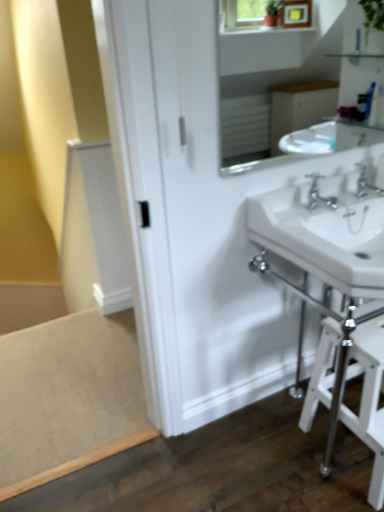
Question: Considering the relative sizes of white ceramic sink at right and white glossy sink at upper center in the image provided, is white ceramic sink at right bigger than white glossy sink at upper center?

Choices:
 (A) no
 (B) yes

Answer: (B)

Question: Does white ceramic sink at right have a smaller size compared to white glossy sink at upper center?

Choices:
 (A) yes
 (B) no

Answer: (B)

Question: From the image's perspective, would you say white ceramic sink at right is shown under white glossy sink at upper center?

Choices:
 (A) no
 (B) yes

Answer: (B)

Question: Is white ceramic sink at right completely or partially outside of white glossy sink at upper center?

Choices:
 (A) no
 (B) yes

Answer: (B)

Question: Does white ceramic sink at right have a lesser height compared to white glossy sink at upper center?

Choices:
 (A) no
 (B) yes

Answer: (B)

Question: From the image's perspective, is white ceramic sink at right over white glossy sink at upper center?

Choices:
 (A) no
 (B) yes

Answer: (A)

Question: From a real-world perspective, is chrome metallic faucet at center, positioned as the 2th tap in right-to-left order, positioned under chrome metallic faucet at upper right, which ranks as the second tap in left-to-right order, based on gravity?

Choices:
 (A) yes
 (B) no

Answer: (A)

Question: Considering the relative sizes of chrome metallic faucet at center, positioned as the 2th tap in right-to-left order, and chrome metallic faucet at upper right, which ranks as the second tap in left-to-right order, in the image provided, is chrome metallic faucet at center, positioned as the 2th tap in right-to-left order, thinner than chrome metallic faucet at upper right, which ranks as the second tap in left-to-right order,?

Choices:
 (A) no
 (B) yes

Answer: (A)

Question: Is chrome metallic faucet at center, positioned as the 2th tap in right-to-left order, wider than chrome metallic faucet at upper right, positioned as the first tap in right-to-left order?

Choices:
 (A) no
 (B) yes

Answer: (B)

Question: From the image's perspective, does chrome metallic faucet at center, positioned as the 1th tap in left-to-right order, appear lower than chrome metallic faucet at upper right, positioned as the first tap in right-to-left order?

Choices:
 (A) no
 (B) yes

Answer: (B)

Question: Could chrome metallic faucet at upper right, positioned as the first tap in right-to-left order, be considered to be inside chrome metallic faucet at center, positioned as the 2th tap in right-to-left order?

Choices:
 (A) no
 (B) yes

Answer: (A)

Question: Is chrome metallic faucet at center, positioned as the 2th tap in right-to-left order, at the right side of chrome metallic faucet at upper right, positioned as the first tap in right-to-left order?

Choices:
 (A) yes
 (B) no

Answer: (B)

Question: From the image's perspective, is chrome metallic faucet at upper right, which ranks as the second tap in left-to-right order, below white glossy sink at upper center?

Choices:
 (A) yes
 (B) no

Answer: (A)